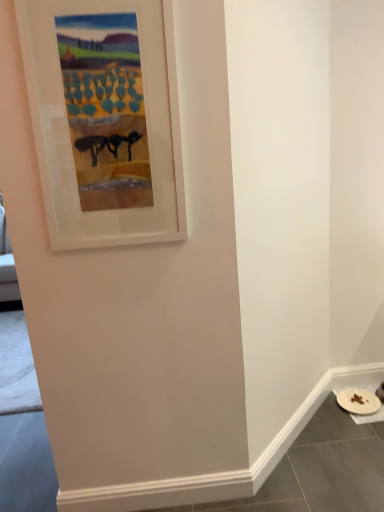
Question: From their relative heights in the image, would you say wooden picture frame at upper left is taller or shorter than white matte plate at lower right?

Choices:
 (A) tall
 (B) short

Answer: (A)

Question: In terms of size, does wooden picture frame at upper left appear bigger or smaller than white matte plate at lower right?

Choices:
 (A) big
 (B) small

Answer: (A)

Question: From a real-world perspective, is wooden picture frame at upper left physically located above or below white matte plate at lower right?

Choices:
 (A) above
 (B) below

Answer: (A)

Question: Based on their positions, is white matte plate at lower right located to the left or right of wooden picture frame at upper left?

Choices:
 (A) left
 (B) right

Answer: (B)

Question: From the image's perspective, relative to wooden picture frame at upper left, is white matte plate at lower right above or below?

Choices:
 (A) below
 (B) above

Answer: (A)

Question: From a real-world perspective, is white matte plate at lower right above or below wooden picture frame at upper left?

Choices:
 (A) above
 (B) below

Answer: (B)

Question: Looking at their shapes, would you say white matte plate at lower right is wider or thinner than wooden picture frame at upper left?

Choices:
 (A) thin
 (B) wide

Answer: (B)